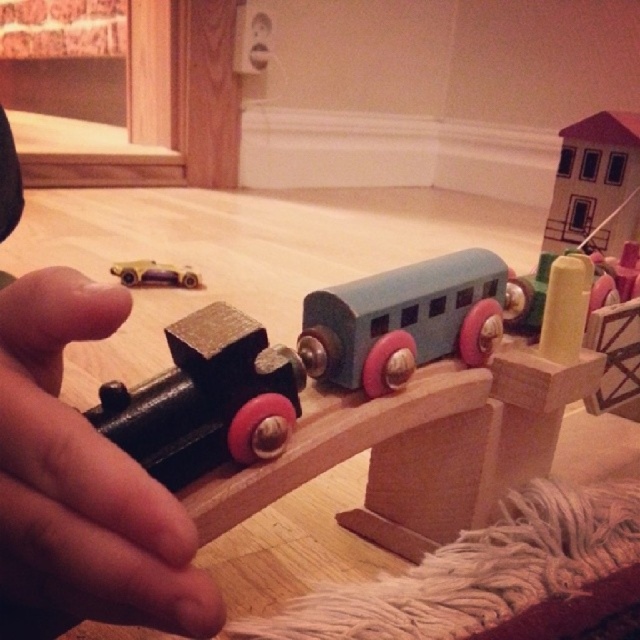
Is brushed metal train at center positioned behind matte blue wooden train car at center?

No, it is in front of matte blue wooden train car at center.

Is point (177, 349) closer to camera compared to point (410, 269)?

Yes.

Identify the location of brushed metal train at center. Image resolution: width=640 pixels, height=640 pixels. (202, 397).

I want to click on matte blue wooden train car at center, so (404, 321).

Is point (472, 273) closer to viewer compared to point (173, 285)?

Yes, point (472, 273) is closer to viewer.

Is point (488, 275) farther from camera compared to point (188, 268)?

No, it is in front of (188, 268).

Identify the location of matte blue wooden train car at center. The width and height of the screenshot is (640, 640). (404, 321).

Consider the image. Is brushed metal train at center thinner than metallic gold car at left?

Correct, brushed metal train at center's width is less than metallic gold car at left's.

Can you confirm if brushed metal train at center is positioned to the left of metallic gold car at left?

Incorrect, brushed metal train at center is not on the left side of metallic gold car at left.

Is point (241, 330) closer to camera compared to point (131, 276)?

That is True.

Find the location of a particular element. The width and height of the screenshot is (640, 640). brushed metal train at center is located at coordinates (202, 397).